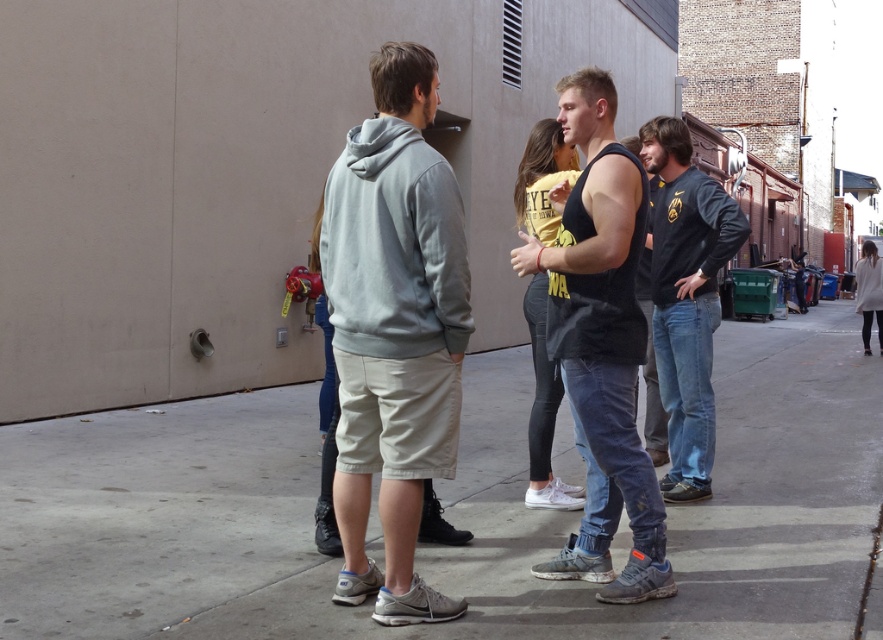
Question: Which object is the farthest from the light gray hoodie at center?

Choices:
 (A) dark gray sweatshirt at right
 (B) gray concrete pavement at center

Answer: (A)

Question: Is gray concrete pavement at center below black tank top at center?

Choices:
 (A) yes
 (B) no

Answer: (A)

Question: Does black tank top at center have a smaller size compared to light gray sweater at right?

Choices:
 (A) yes
 (B) no

Answer: (B)

Question: Which of the following is the farthest from the observer?

Choices:
 (A) matte yellow t-shirt at center
 (B) light gray sweater at right

Answer: (B)

Question: Which of the following is the closest to the observer?

Choices:
 (A) gray concrete pavement at center
 (B) matte yellow t-shirt at center
 (C) light gray sweater at right

Answer: (A)

Question: Where is gray concrete pavement at center located in relation to dark gray sweatshirt at right in the image?

Choices:
 (A) above
 (B) below

Answer: (B)